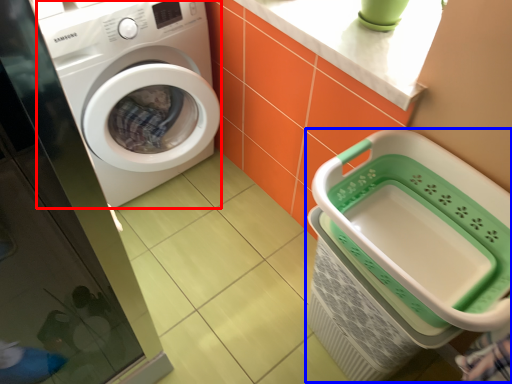
Question: Among these objects, which one is nearest to the camera, washing machine (highlighted by a red box) or shopping basket (highlighted by a blue box)?

Choices:
 (A) washing machine
 (B) shopping basket

Answer: (B)